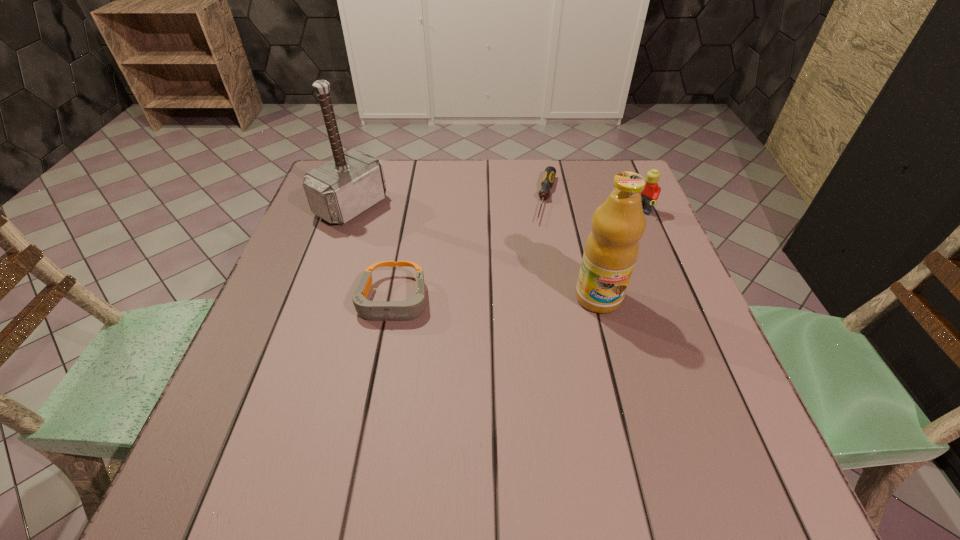
What are the coordinates of `free space on the desktop that is between the second shortest object and the olive oil and is positioned insert the screwdriver into a screw head` in the screenshot? It's located at (520, 299).

You are a GUI agent. You are given a task and a screenshot of the screen. Output one action in this format:
    pyautogui.click(x=<x>, y=<y>)
    Task: Click on the free space on the desktop that is between the second shortest object and the olive oil and is positioned for striking with the head of the hammer
    The image size is (960, 540).
    Given the screenshot: What is the action you would take?
    pyautogui.click(x=523, y=299)

Locate an element on the screen. The image size is (960, 540). free space on the desktop that is between the goggles and the olive oil and is positioned on the face of the rightmost object is located at coordinates (524, 299).